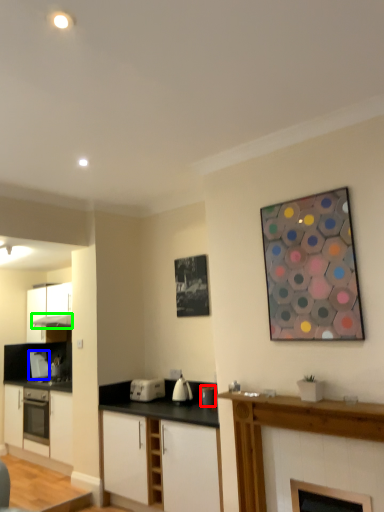
Question: Which object is the farthest from appliance (highlighted by a red box)? Choose among these: appliance (highlighted by a blue box) or exhaust hood (highlighted by a green box).

Choices:
 (A) appliance
 (B) exhaust hood

Answer: (B)